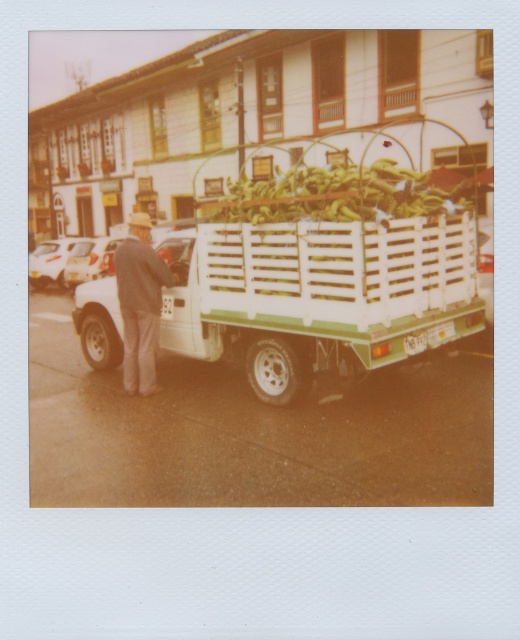
You are a customer looking to buy bananas from the vendor. You see the white wooden crate at center and the gray woolen jacket at left. Which item is closer to you?

The white wooden crate at center is positioned under the gray woolen jacket at left, meaning the crate is closer to you since it is underneath the jacket.

You are a delivery person trying to load a new item into the truck bed. The item is exactly the same size as the gray woolen jacket at left. Based on the scene, can the white wooden crate at center also fit in the truck bed along with this new item?

The white wooden crate at center is wider than the gray woolen jacket at left. Since the new item is the same size as the gray woolen jacket at left, the white wooden crate at center may not fit alongside it in the truck bed due to its larger width.